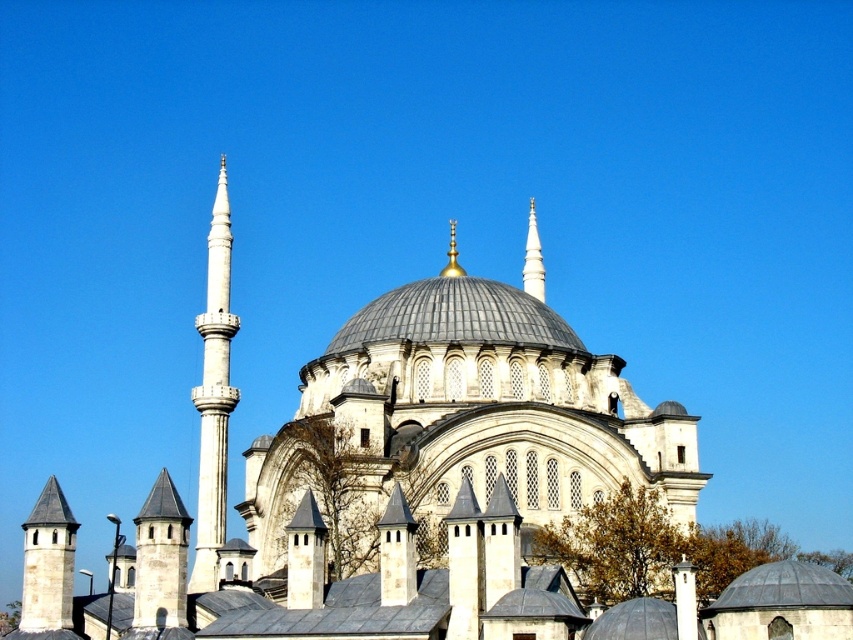
Question: Can you confirm if white stone minaret at left is positioned above stone tower at lower left?

Choices:
 (A) yes
 (B) no

Answer: (A)

Question: Estimate the real-world distances between objects in this image. Which object is farther from the white marble spire at center?

Choices:
 (A) stone tower at lower left
 (B) gold/golden metallic spire at center
 (C) white stone minaret at left

Answer: (A)

Question: Is white stone minaret at lower left smaller than stone tower at lower left?

Choices:
 (A) no
 (B) yes

Answer: (A)

Question: Is white marble spire at center below gold/golden metallic spire at center?

Choices:
 (A) yes
 (B) no

Answer: (A)

Question: Which point is farther to the camera?

Choices:
 (A) (540, 285)
 (B) (212, 305)
 (C) (451, 272)
 (D) (65, 596)

Answer: (A)

Question: Which of the following is the closest to the observer?

Choices:
 (A) white stone minaret at left
 (B) stone tower at lower left
 (C) gold/golden metallic spire at center

Answer: (B)